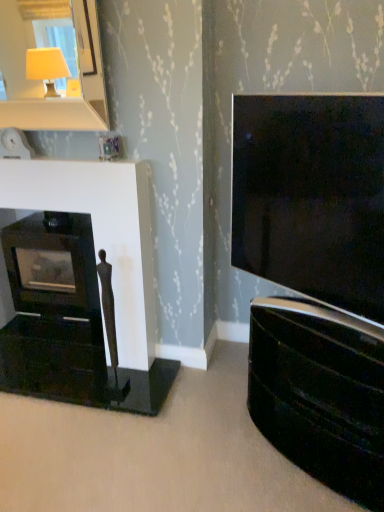
Where is `vacant space in matte black fireplace at left (from a real-world perspective)`? The height and width of the screenshot is (512, 384). vacant space in matte black fireplace at left (from a real-world perspective) is located at coordinates 54,351.